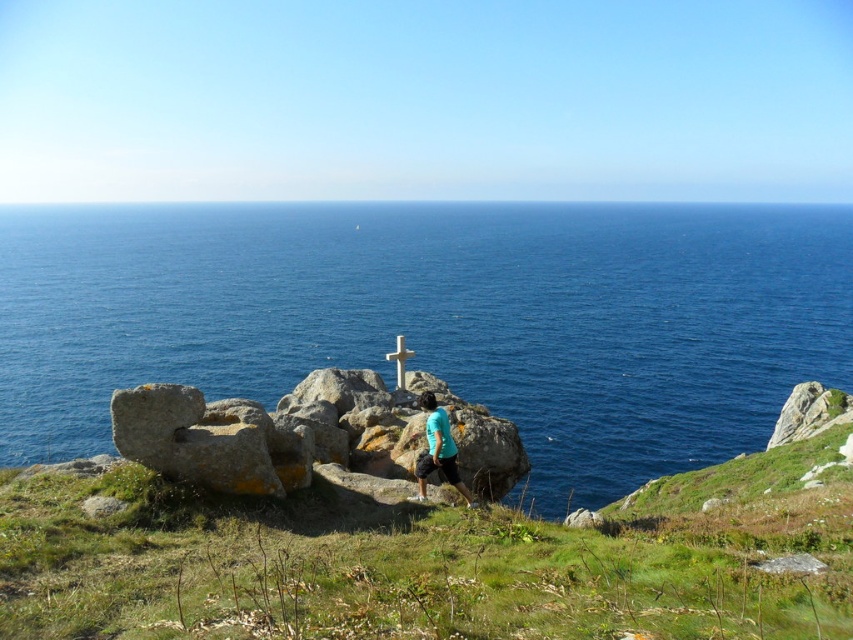
You are a photographer planning to capture the entire scene in one shot. Given that the blue water at center and the green grassy at center are both in your frame, which area will occupy more space in your photo?

The blue water at center will occupy more space in the photo because its width is larger than the green grassy at center.

You are standing at the point marked as point (421,563) in the image. Looking around, you see green grassy at center. Which direction should you walk to reach the white cross on the rocks?

The point (421,563) is located on the green grassy at center. To reach the white cross on the rocks, you should walk towards the mid ground where the rocks are located, as the cross is situated atop them.